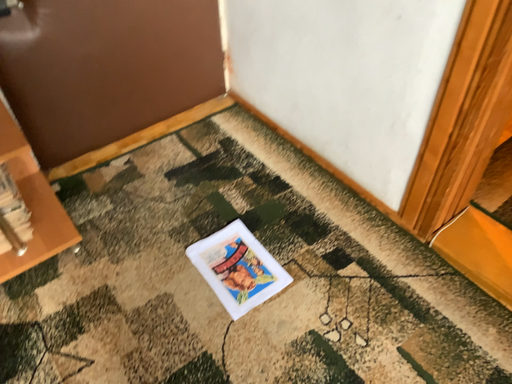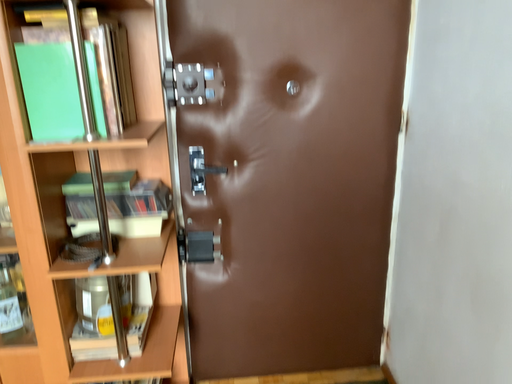
Question: How did the camera likely rotate when shooting the video?

Choices:
 (A) rotated right
 (B) rotated left

Answer: (B)